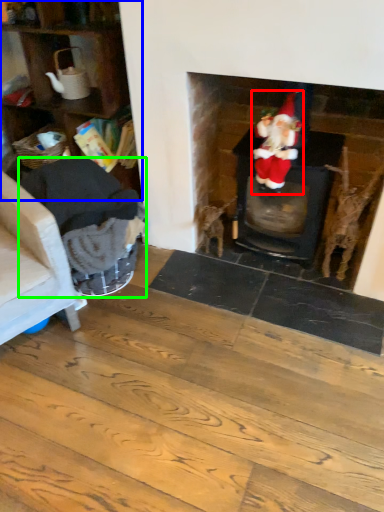
Question: Which object is the farthest from person (highlighted by a red box)? Choose among these: shelf (highlighted by a blue box) or armchair (highlighted by a green box).

Choices:
 (A) shelf
 (B) armchair

Answer: (A)